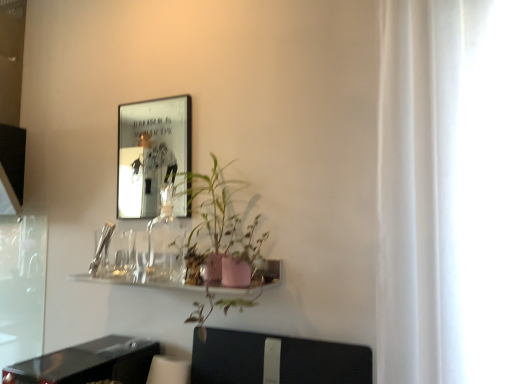
Question: From the image's perspective, is black plastic swivel chair at lower center on top of black glossy table at lower left?

Choices:
 (A) yes
 (B) no

Answer: (A)

Question: Can you see black plastic swivel chair at lower center touching black glossy table at lower left?

Choices:
 (A) no
 (B) yes

Answer: (A)

Question: Is black plastic swivel chair at lower center not close to black glossy table at lower left?

Choices:
 (A) yes
 (B) no

Answer: (B)

Question: Is the depth of black plastic swivel chair at lower center less than that of black glossy table at lower left?

Choices:
 (A) yes
 (B) no

Answer: (B)

Question: Is black plastic swivel chair at lower center wider than black glossy table at lower left?

Choices:
 (A) yes
 (B) no

Answer: (B)

Question: Is black glossy table at lower left bigger or smaller than pink matte pot at center?

Choices:
 (A) small
 (B) big

Answer: (A)

Question: Is black glossy table at lower left taller or shorter than pink matte pot at center?

Choices:
 (A) short
 (B) tall

Answer: (A)

Question: Relative to pink matte pot at center, is black glossy table at lower left in front or behind?

Choices:
 (A) behind
 (B) front

Answer: (A)

Question: Do you think black glossy table at lower left is within pink matte pot at center, or outside of it?

Choices:
 (A) inside
 (B) outside

Answer: (B)

Question: Would you say black glossy table at lower left is to the left or to the right of black plastic swivel chair at lower center in the picture?

Choices:
 (A) right
 (B) left

Answer: (B)

Question: From a real-world perspective, is black glossy table at lower left above or below black plastic swivel chair at lower center?

Choices:
 (A) below
 (B) above

Answer: (A)

Question: From the image's perspective, relative to black plastic swivel chair at lower center, is black glossy table at lower left above or below?

Choices:
 (A) below
 (B) above

Answer: (A)

Question: Considering the positions of point (24, 375) and point (338, 354), is point (24, 375) closer or farther from the camera than point (338, 354)?

Choices:
 (A) farther
 (B) closer

Answer: (A)

Question: Which is correct: metallic reflective frame at upper left is inside pink matte pot at center, or outside of it?

Choices:
 (A) inside
 (B) outside

Answer: (B)

Question: Considering the positions of metallic reflective frame at upper left and pink matte pot at center in the image, is metallic reflective frame at upper left bigger or smaller than pink matte pot at center?

Choices:
 (A) big
 (B) small

Answer: (B)